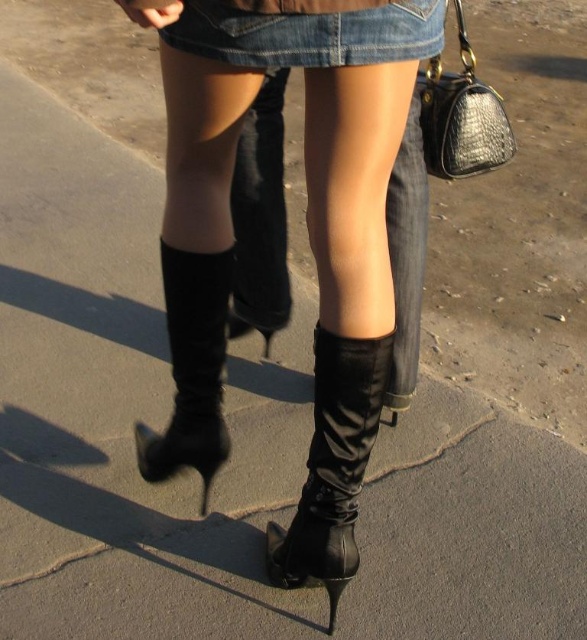
You are a photographer trying to capture the perfect shot of the black satin boot at lower center. Based on its 2D coordinates, where should you position your camera to ensure it is centered in the frame?

The black satin boot at lower center is located at coordinates 0.730 on the x axis and 0.567 on the y axis. To center it in the frame, position your camera so that the boot aligns with the center point of the image, which is typically at coordinates around 0.5 on both axes. Adjust your camera to the right and slightly upward to move the boot closer to the center.

You are a delivery robot with a height of 1.2 meters. You are standing in front of the black leather boots at lower center. Can you see the top of the boots?

The black leather boots at lower center are 1.18 meters away from the viewer. Since the robot is 1.2 meters tall, it can likely see the top of the black leather boots at lower center as the distance is slightly less than its height.